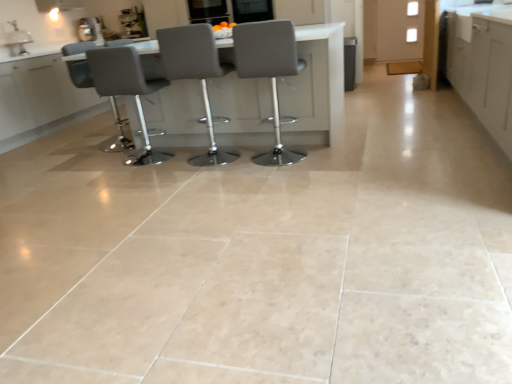
What do you see at coordinates (118, 134) in the screenshot? Image resolution: width=512 pixels, height=384 pixels. I see `matte gray chair at left, acting as the first chair starting from the left` at bounding box center [118, 134].

Locate an element on the screen. This screenshot has height=384, width=512. matte gray chair at left, the 4th chair positioned from the right is located at coordinates (118, 134).

Measure the distance between point (169, 158) and camera.

Point (169, 158) and camera are 12.04 feet apart from each other.

The image size is (512, 384). Identify the location of metallic silver coffee machine at upper left. (90, 31).

Measure the distance between matte gray chair at center, which is the 3th chair from left to right, and camera.

The distance of matte gray chair at center, which is the 3th chair from left to right, from camera is 9.48 feet.

What are the coordinates of `matte gray table at center` in the screenshot? It's located at (315, 87).

Where is `gray leather stool at center, the 1th chair from the right`? This screenshot has width=512, height=384. gray leather stool at center, the 1th chair from the right is located at coordinates (269, 74).

This screenshot has height=384, width=512. What are the coordinates of `white matte cabinet at upper right, the second cabinetry when ordered from bottom to top` in the screenshot? It's located at (400, 30).

Locate an element on the screen. matte gray chair at left, acting as the first chair starting from the left is located at coordinates (118, 134).

Is white glossy sink at upper left facing towards matte gray table at center?

Yes, white glossy sink at upper left faces towards matte gray table at center.

Is white glossy sink at upper left to the left of matte gray table at center from the viewer's perspective?

Yes.

There is a matte gray table at center. What are the coordinates of `sink above it (from a real-world perspective)` in the screenshot? It's located at (17, 40).

From the image's perspective, does white glossy sink at upper left appear lower than matte gray table at center?

Actually, white glossy sink at upper left appears above matte gray table at center in the image.

Which is behind, point (277, 134) or point (190, 50)?

Positioned behind is point (277, 134).

In the scene shown: Is matte gray chair at center, which is the 3th chair from left to right, at the back of gray leather stool at center, the 1th chair from the right?

No, gray leather stool at center, the 1th chair from the right,'s orientation is not away from matte gray chair at center, which is the 3th chair from left to right.

From the picture: From a real-world perspective, who is located higher, gray leather stool at center, placed as the 4th chair when sorted from left to right, or matte gray chair at center, arranged as the second chair when viewed from the right?

matte gray chair at center, arranged as the second chair when viewed from the right, from a real-world perspective.

At what (x,y) coordinates should I click in order to perform the action: click on chair on the right of matte gray chair at center, which is the 3th chair from left to right. Please return your answer as a coordinate pair (x, y). Looking at the image, I should click on (269, 74).

Considering the sizes of objects matte gray chair at left, acting as the first chair starting from the left, and white glossy sink at upper left in the image provided, who is wider, matte gray chair at left, acting as the first chair starting from the left, or white glossy sink at upper left?

matte gray chair at left, acting as the first chair starting from the left.

Considering the positions of objects matte gray chair at left, acting as the first chair starting from the left, and white glossy sink at upper left in the image provided, who is more to the left, matte gray chair at left, acting as the first chair starting from the left, or white glossy sink at upper left?

Positioned to the left is white glossy sink at upper left.

Is matte gray chair at left, acting as the first chair starting from the left, looking in the opposite direction of white glossy sink at upper left?

No.

Is point (106, 145) closer or farther from the camera than point (12, 21)?

Point (106, 145) appears to be closer to the viewer than point (12, 21).

Can white matte cabinet at upper right, which is the first cabinetry from top to bottom, be found inside matte gray table at center?

No, white matte cabinet at upper right, which is the first cabinetry from top to bottom, is not inside matte gray table at center.

Looking at this image, would you say matte gray table at center is a long distance from white matte cabinet at upper right, the second cabinetry when ordered from bottom to top?

Yes.

Is matte gray table at center taller or shorter than white matte cabinet at upper right, the 1th cabinetry in the back-to-front sequence?

In the image, matte gray table at center appears to be shorter than white matte cabinet at upper right, the 1th cabinetry in the back-to-front sequence.

I want to click on appliance located on the left of matte gray chair at center, which is counted as the second chair, starting from the left, so click(x=90, y=31).

Which of these two, matte gray chair at center, which ranks as the third chair in right-to-left order, or metallic silver coffee machine at upper left, stands taller?

matte gray chair at center, which ranks as the third chair in right-to-left order, is taller.

Based on the photo, can you tell me how much matte gray chair at center, which ranks as the third chair in right-to-left order, and metallic silver coffee machine at upper left differ in facing direction?

109 degrees separate the facing orientations of matte gray chair at center, which ranks as the third chair in right-to-left order, and metallic silver coffee machine at upper left.

Between matte gray chair at center, which ranks as the third chair in right-to-left order, and metallic silver coffee machine at upper left, which one has larger size?

Bigger between the two is matte gray chair at center, which ranks as the third chair in right-to-left order.

Is white matte cabinet at upper right, which is the first cabinetry from top to bottom, to the right of metallic silver coffee machine at upper left from the viewer's perspective?

Indeed, white matte cabinet at upper right, which is the first cabinetry from top to bottom, is positioned on the right side of metallic silver coffee machine at upper left.

Does point (391, 38) lie in front of point (99, 38)?

No, it is behind (99, 38).

Is white matte cabinet at upper right, which is the first cabinetry from top to bottom, not near metallic silver coffee machine at upper left?

Indeed, white matte cabinet at upper right, which is the first cabinetry from top to bottom, is not near metallic silver coffee machine at upper left.

From the image's perspective, is white matte cabinet at upper right, which is the first cabinetry from top to bottom, over metallic silver coffee machine at upper left?

Correct, white matte cabinet at upper right, which is the first cabinetry from top to bottom, appears higher than metallic silver coffee machine at upper left in the image.

How different are the orientations of metallic silver coffee machine at upper left and matte gray chair at center, which is the 3th chair from left to right, in degrees?

114 degrees separate the facing orientations of metallic silver coffee machine at upper left and matte gray chair at center, which is the 3th chair from left to right.

Is metallic silver coffee machine at upper left aimed at matte gray chair at center, which is the 3th chair from left to right?

Yes, metallic silver coffee machine at upper left faces towards matte gray chair at center, which is the 3th chair from left to right.

From the image's perspective, who appears lower, metallic silver coffee machine at upper left or matte gray chair at center, which is the 3th chair from left to right?

matte gray chair at center, which is the 3th chair from left to right, is shown below in the image.

Which is in front, point (100, 31) or point (193, 165)?

Point (193, 165)

Where is `sink positioned vertically above the matte gray table at center (from a real-world perspective)`? The height and width of the screenshot is (384, 512). sink positioned vertically above the matte gray table at center (from a real-world perspective) is located at coordinates (17, 40).

The image size is (512, 384). In order to click on the 1st chair above when counting from the gray leather stool at center, placed as the 4th chair when sorted from left to right (from the image's perspective) in this screenshot , I will do `click(196, 76)`.

Based on their spatial positions, is white matte cabinet at right, arranged as the 2th cabinetry when viewed from the back, or gray leather stool at center, the 1th chair from the right, closer to white glossy sink at upper left?

Based on the image, gray leather stool at center, the 1th chair from the right, appears to be nearer to white glossy sink at upper left.

Considering their positions, is white matte cabinet at right, the 2th cabinetry viewed from the top, positioned further to matte gray chair at center, which is counted as the second chair, starting from the left, than white matte cabinet at upper right, the 1th cabinetry in the back-to-front sequence?

white matte cabinet at upper right, the 1th cabinetry in the back-to-front sequence.

Looking at the image, which one is located closer to metallic silver coffee machine at upper left, matte gray chair at left, the 4th chair positioned from the right, or matte gray table at center?

matte gray chair at left, the 4th chair positioned from the right.

Which object lies nearer to the anchor point matte gray chair at center, which ranks as the third chair in right-to-left order, matte gray table at center or gray leather stool at center, placed as the 4th chair when sorted from left to right?

Among the two, matte gray table at center is located nearer to matte gray chair at center, which ranks as the third chair in right-to-left order.

From the image, which object appears to be farther from metallic silver coffee machine at upper left, white matte cabinet at upper right, the second cabinetry when ordered from bottom to top, or matte gray chair at center, which ranks as the third chair in right-to-left order?

The object further to metallic silver coffee machine at upper left is white matte cabinet at upper right, the second cabinetry when ordered from bottom to top.

Looking at the image, which one is located further to white glossy sink at upper left, white matte cabinet at upper right, which ranks as the second cabinetry in front-to-back order, or matte gray table at center?

white matte cabinet at upper right, which ranks as the second cabinetry in front-to-back order, lies further to white glossy sink at upper left than the other object.

Based on their spatial positions, is matte gray table at center or matte gray chair at center, which ranks as the third chair in right-to-left order, closer to white glossy sink at upper left?

Based on the image, matte gray chair at center, which ranks as the third chair in right-to-left order, appears to be nearer to white glossy sink at upper left.

Considering their positions, is metallic silver coffee machine at upper left positioned further to white glossy sink at upper left than gray leather stool at center, the 1th chair from the right?

gray leather stool at center, the 1th chair from the right, lies further to white glossy sink at upper left than the other object.

At what (x,y) coordinates should I click in order to perform the action: click on table between metallic silver coffee machine at upper left and white matte cabinet at upper right, which ranks as the second cabinetry in front-to-back order, from left to right. Please return your answer as a coordinate pair (x, y). This screenshot has width=512, height=384. Looking at the image, I should click on (315, 87).

You are a GUI agent. You are given a task and a screenshot of the screen. Output one action in this format:
    pyautogui.click(x=<x>, y=<y>)
    Task: Click on the table located between white glossy sink at upper left and white matte cabinet at upper right, the second cabinetry when ordered from bottom to top, in the left-right direction
    Image resolution: width=512 pixels, height=384 pixels.
    Given the screenshot: What is the action you would take?
    pyautogui.click(x=315, y=87)

Locate an element on the screen. The height and width of the screenshot is (384, 512). sink between matte gray chair at center, which ranks as the third chair in right-to-left order, and metallic silver coffee machine at upper left, along the z-axis is located at coordinates (17, 40).

This screenshot has height=384, width=512. Identify the location of appliance located between white glossy sink at upper left and white matte cabinet at right, positioned as the first cabinetry in front-to-back order, in the left-right direction. (90, 31).